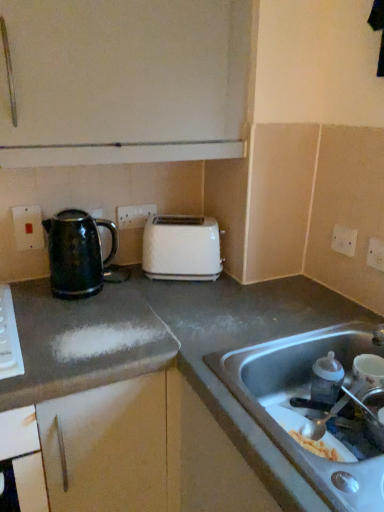
Where is `vacant area that is in front of white plastic toaster at center`? vacant area that is in front of white plastic toaster at center is located at coordinates (182, 298).